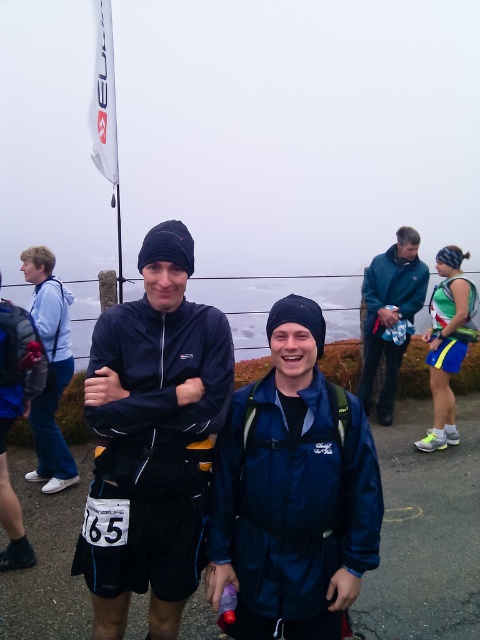
Based on the scene description, where is the matte blue jacket at left located in terms of its 2D coordinates?

The matte blue jacket at left is located at the 2D coordinates of point [49,369].

You are a photographer positioned at point (49, 369) in the image. You want to capture a photo of the matte blue jacket at left. Is the point where you are standing directly in front of the matte blue jacket at left?

Yes, the point (49, 369) corresponds to the matte blue jacket at left, so the photographer is directly in front of it.

You are a photographer at the event and want to capture a photo of the navy blue jacket at center and the teal fabric jacket at center. From the perspective of someone facing the scene, which jacket is positioned to the left?

The navy blue jacket at center is positioned to the left of the teal fabric jacket at center, so the navy blue jacket at center is on the left side.